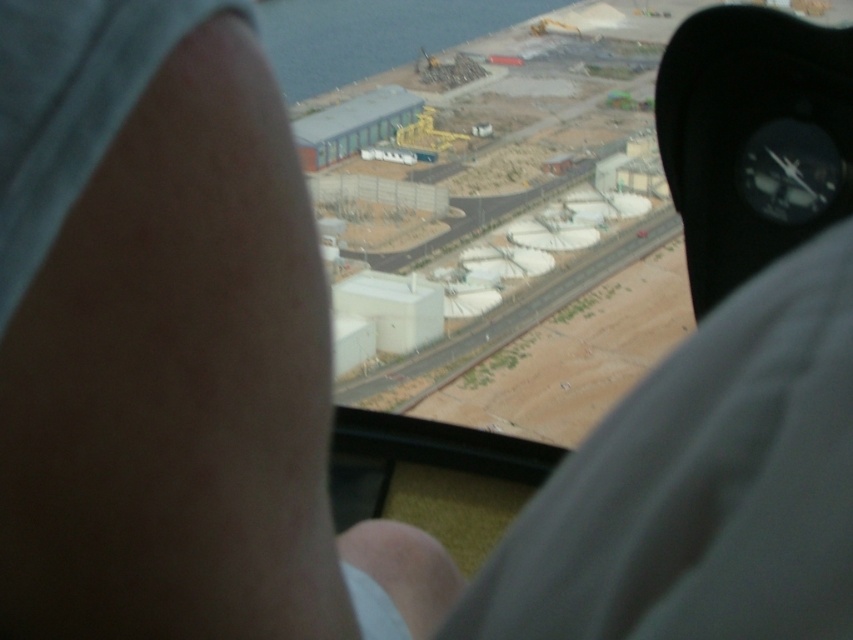
Question: Can you confirm if blue water at upper left is positioned to the right of white concrete train track at center?

Choices:
 (A) yes
 (B) no

Answer: (B)

Question: Among these objects, which one is farthest from the camera?

Choices:
 (A) blue water at upper left
 (B) white concrete train track at center

Answer: (B)

Question: Is blue water at upper left smaller than white concrete train track at center?

Choices:
 (A) yes
 (B) no

Answer: (B)

Question: Which point is closer to the camera?

Choices:
 (A) (668, 227)
 (B) (300, 72)

Answer: (A)

Question: Can you confirm if blue water at upper left is positioned to the right of white concrete train track at center?

Choices:
 (A) no
 (B) yes

Answer: (A)